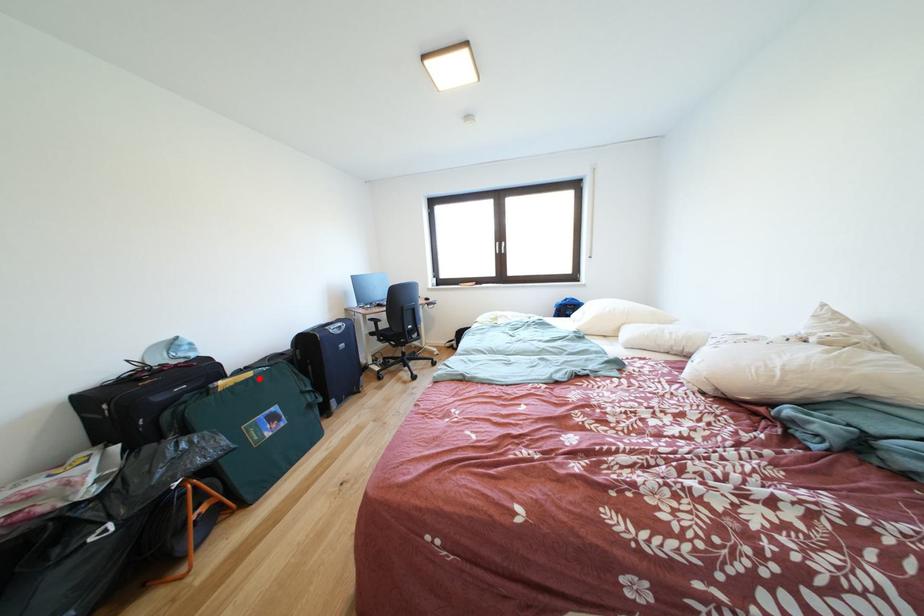
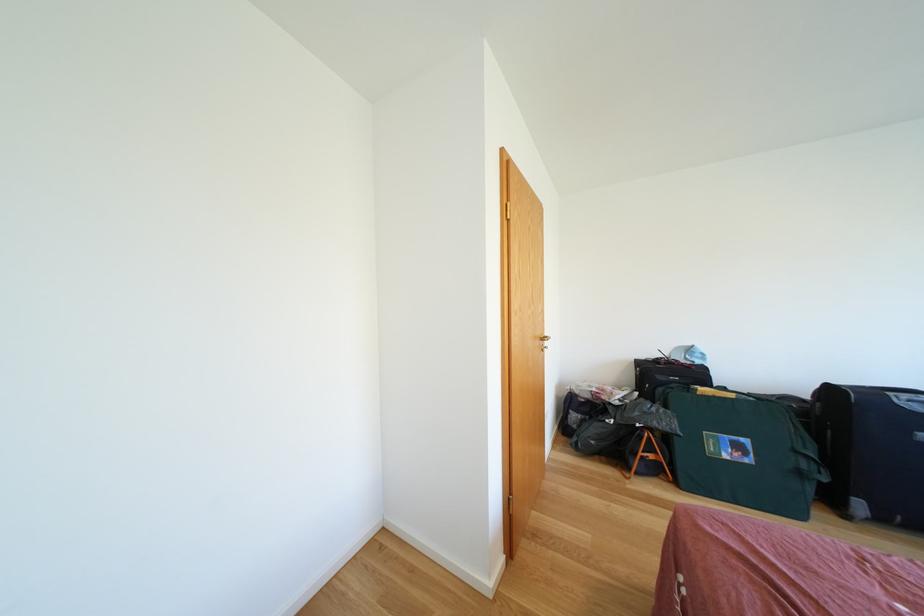
Question: I am providing you with two images of the same scene from different viewpoints. Given a red point in image1, look at the same physical point in image2. Is it:

Choices:
 (A) Closer to the viewpoint
 (B) Farther from the viewpoint

Answer: (B)